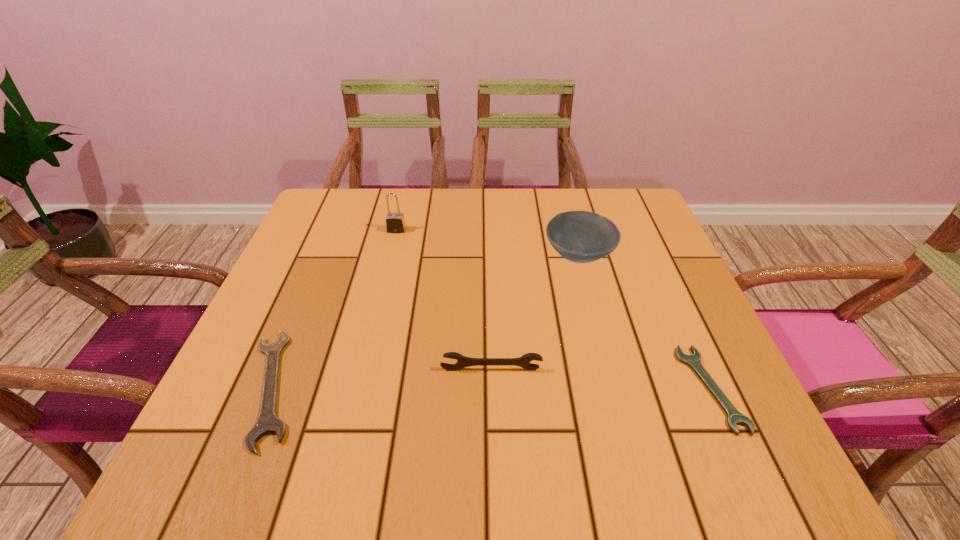
Image resolution: width=960 pixels, height=540 pixels. What are the coordinates of `free spot located 0.240m on the shackle of the fourth object from right to left` in the screenshot? It's located at (380, 300).

The image size is (960, 540). What are the coordinates of `free space located on the left of the fourth nearest object` in the screenshot? It's located at (403, 255).

Locate an element on the screen. free point located 0.160m on the open ends of the third object from left to right is located at coordinates (493, 454).

The image size is (960, 540). Identify the location of free space located on the back of the leftmost wrench. (321, 268).

Find the location of a particular element. The image size is (960, 540). vacant space located 0.240m on the left of the rightmost wrench is located at coordinates (554, 388).

You are a GUI agent. You are given a task and a screenshot of the screen. Output one action in this format:
    pyautogui.click(x=<x>, y=<y>)
    Task: Click on the padlock situated at the far edge
    The image size is (960, 540).
    Given the screenshot: What is the action you would take?
    pyautogui.click(x=395, y=222)

Identify the location of bowl located in the far edge section of the desktop. (578, 236).

The width and height of the screenshot is (960, 540). I want to click on object that is positioned at the left edge, so click(x=267, y=422).

What are the coordinates of `bowl situated at the right edge` in the screenshot? It's located at (578, 236).

Find the location of a particular element. The width and height of the screenshot is (960, 540). wrench situated at the right edge is located at coordinates (734, 417).